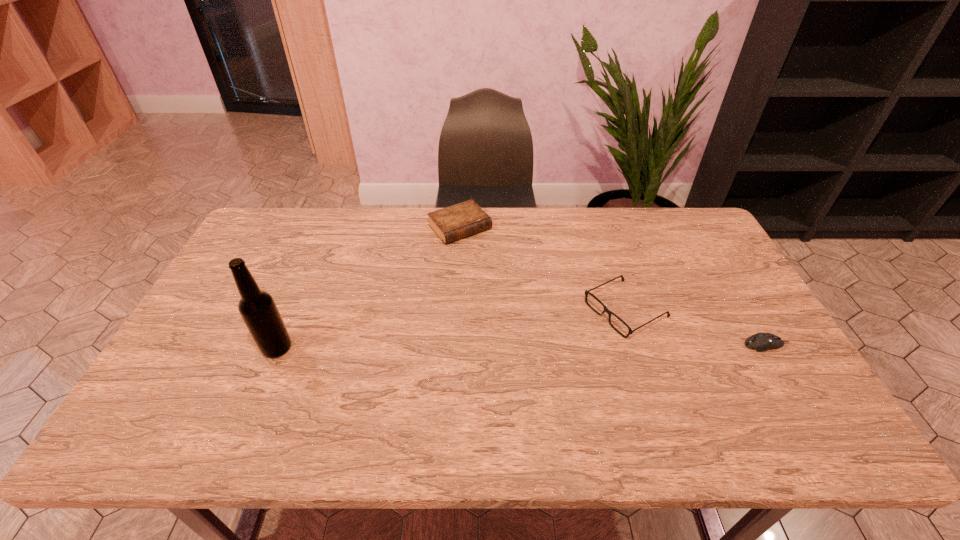
Where is `free space on the desktop that is between the leftmost object and the shortest object and is positioned on the front-facing side of the third object from left to right`? The image size is (960, 540). free space on the desktop that is between the leftmost object and the shortest object and is positioned on the front-facing side of the third object from left to right is located at coordinates (559, 346).

Find the location of `free space on the desktop that is between the leftmost object and the computer mouse and is positioned on the spine side of the diary`. free space on the desktop that is between the leftmost object and the computer mouse and is positioned on the spine side of the diary is located at coordinates (566, 346).